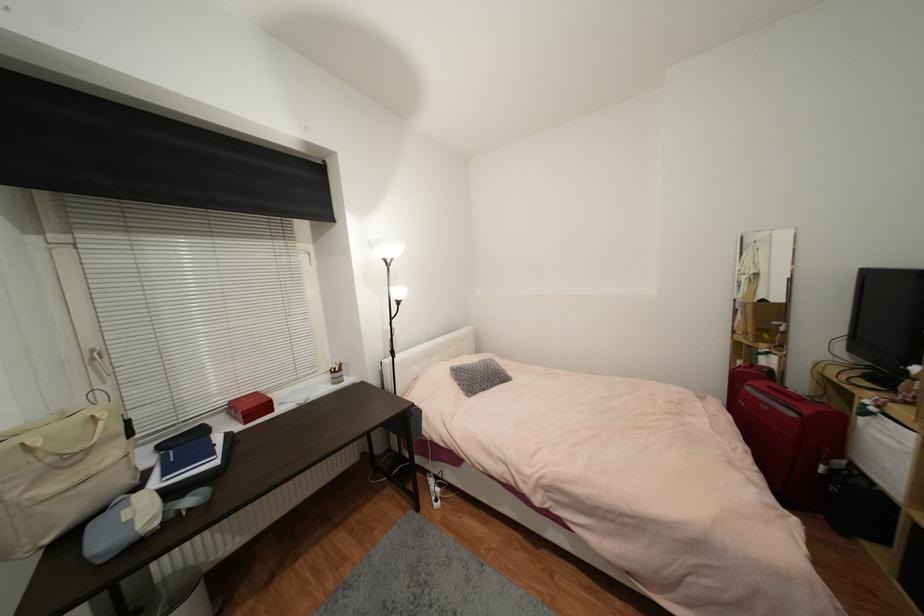
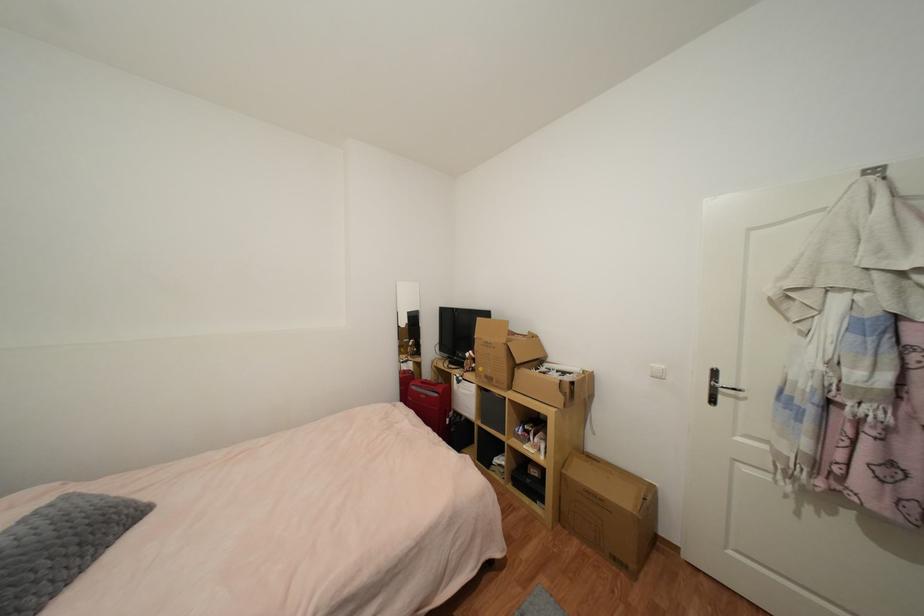
Find the pixel in the second image that matches point 878,411 in the first image.

(465, 379)